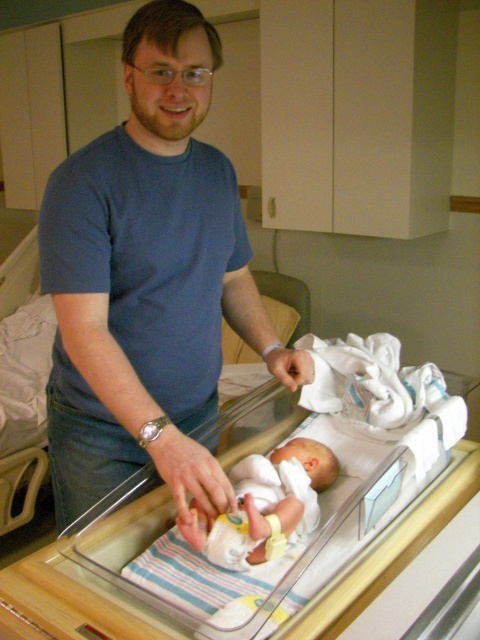
You are a photographer in the hospital room. You want to take a photo of the blue cotton shirt at upper left and the white soft newborn at center. Which one should you focus on first if you want to capture both clearly in the same frame?

The blue cotton shirt at upper left has a larger size compared to the white soft newborn at center, so you should focus on the blue cotton shirt at upper left first to ensure both are in focus.

Based on the photo, in the hospital room scene, there is a white fabric infant bed at center and a white soft newborn at center. Which object is wider?

The white fabric infant bed at center is wider than the white soft newborn at center.